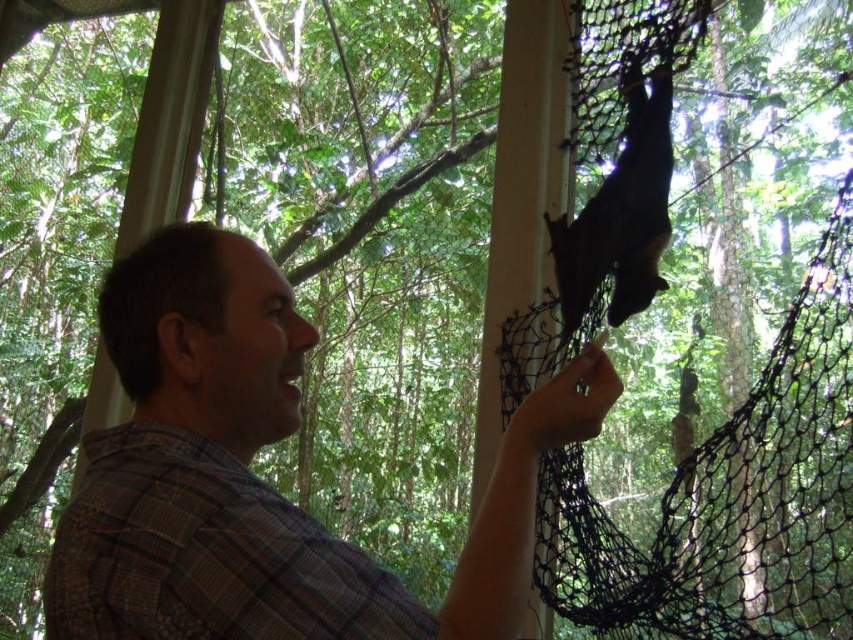
Question: Is plaid shirt at center closer to the viewer compared to black fur bat at upper center?

Choices:
 (A) yes
 (B) no

Answer: (A)

Question: Which point is closer to the camera taking this photo?

Choices:
 (A) (630, 211)
 (B) (531, 508)

Answer: (B)

Question: Among these objects, which one is nearest to the camera?

Choices:
 (A) plaid shirt at center
 (B) black fur bat at upper center

Answer: (A)

Question: Does plaid shirt at center have a larger size compared to black fur bat at upper center?

Choices:
 (A) yes
 (B) no

Answer: (A)

Question: Can you confirm if plaid shirt at center is wider than black fur bat at upper center?

Choices:
 (A) no
 (B) yes

Answer: (B)

Question: Which point is closer to the camera taking this photo?

Choices:
 (A) (645, 188)
 (B) (610, 371)

Answer: (B)